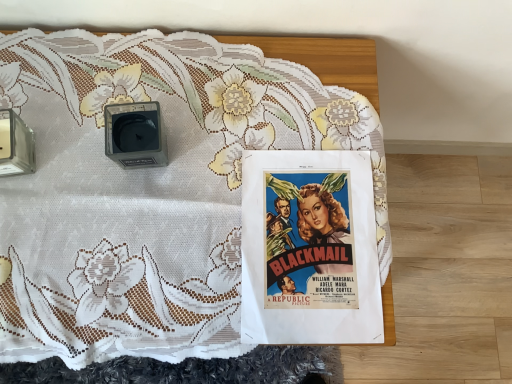
At what (x,y) coordinates should I click in order to perform the action: click on free point behind matte black alarm clock at upper left. Please return your answer as a coordinate pair (x, y). This screenshot has width=512, height=384. Looking at the image, I should click on (158, 70).